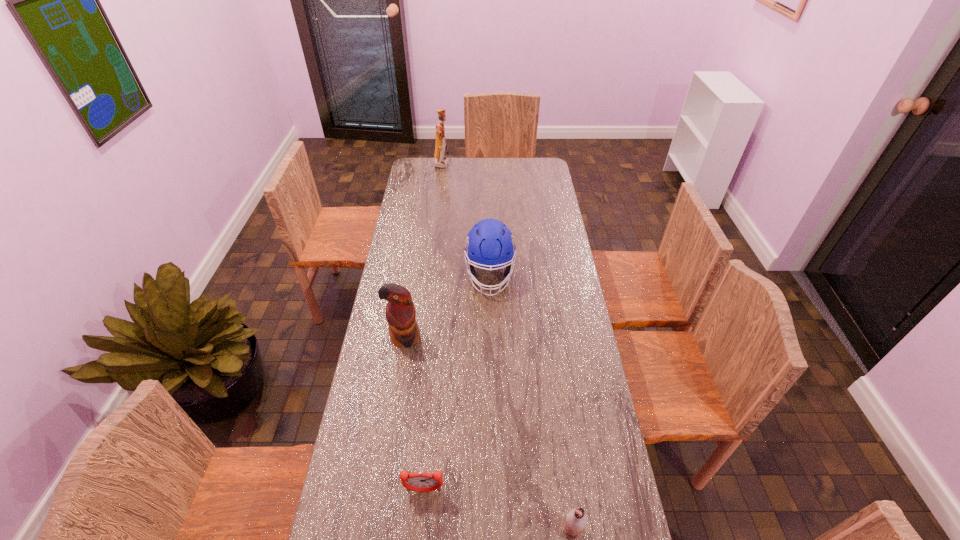
Find the location of a particular element. Image resolution: width=960 pixels, height=540 pixels. object at the far edge is located at coordinates (440, 161).

The image size is (960, 540). Find the location of `nutcracker that is at the left edge`. nutcracker that is at the left edge is located at coordinates pos(440,161).

This screenshot has width=960, height=540. Identify the location of parrot that is at the left edge. (400, 312).

Where is `object that is at the far left corner`? The width and height of the screenshot is (960, 540). object that is at the far left corner is located at coordinates (440, 161).

At what (x,y) coordinates should I click in order to perform the action: click on vacant region at the far edge of the desktop. Please return your answer as a coordinate pair (x, y). Looking at the image, I should click on (456, 161).

Where is `vacant space at the left edge of the desktop`? This screenshot has height=540, width=960. vacant space at the left edge of the desktop is located at coordinates (418, 194).

Identify the location of free region at the right edge of the desktop. This screenshot has height=540, width=960. (564, 411).

The image size is (960, 540). What are the coordinates of `vacant space at the far left corner of the desktop` in the screenshot? It's located at (429, 170).

What are the coordinates of `free spot at the far right corner of the desktop` in the screenshot? It's located at (537, 159).

Where is `free space between the shortest object and the fourth nearest object`? The image size is (960, 540). free space between the shortest object and the fourth nearest object is located at coordinates (457, 383).